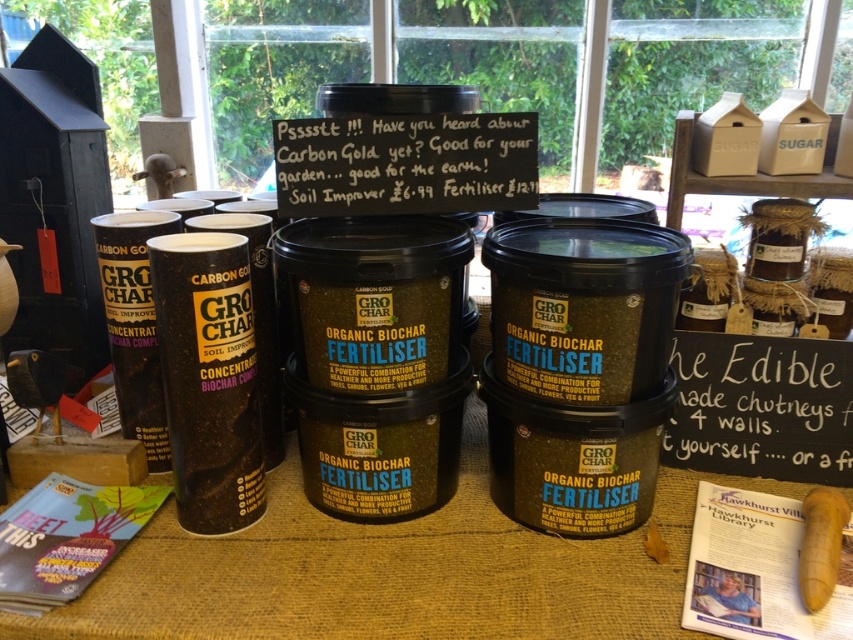
Does black paper sign at center have a lesser width compared to white chalkboard sign at center?

No.

Can you confirm if black paper sign at center is bigger than white chalkboard sign at center?

Yes, black paper sign at center is bigger than white chalkboard sign at center.

Between point (515, 186) and point (697, 468), which one is positioned in front?

Positioned in front is point (515, 186).

What are the coordinates of `black paper sign at center` in the screenshot? It's located at (405, 163).